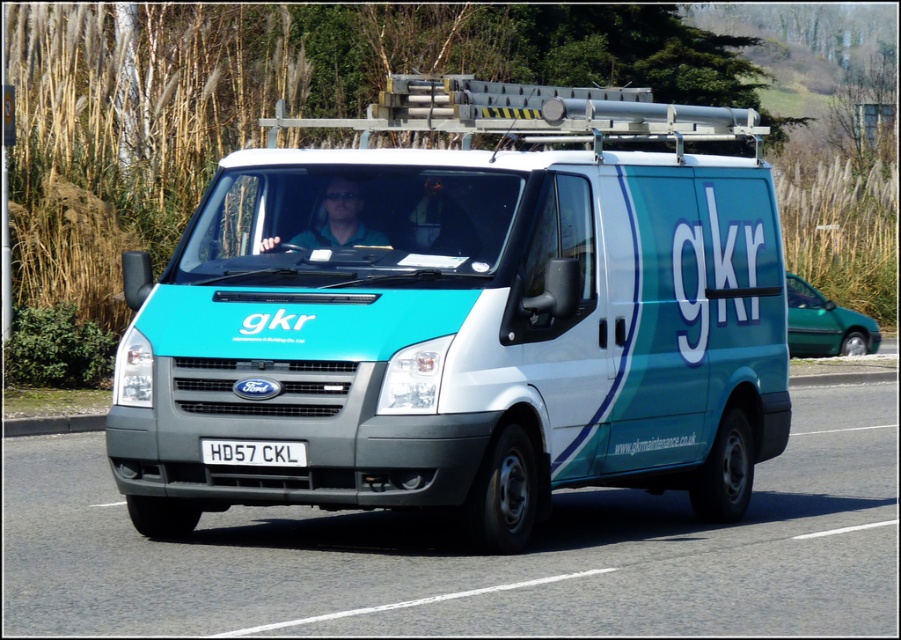
Question: Does matte green shirt at center appear on the left side of white plastic license plate at center?

Choices:
 (A) yes
 (B) no

Answer: (B)

Question: Does teal matte van at center have a lesser width compared to matte green shirt at center?

Choices:
 (A) no
 (B) yes

Answer: (A)

Question: Based on their relative distances, which object is farther from the teal matte van at center?

Choices:
 (A) matte green shirt at center
 (B) white plastic license plate at center

Answer: (A)

Question: Among these objects, which one is farthest from the camera?

Choices:
 (A) matte green shirt at center
 (B) white plastic license plate at center
 (C) teal matte van at center

Answer: (A)

Question: Which object is closer to the camera taking this photo?

Choices:
 (A) teal matte van at center
 (B) white plastic license plate at center

Answer: (A)

Question: Can you confirm if teal matte van at center is positioned above matte green shirt at center?

Choices:
 (A) no
 (B) yes

Answer: (A)